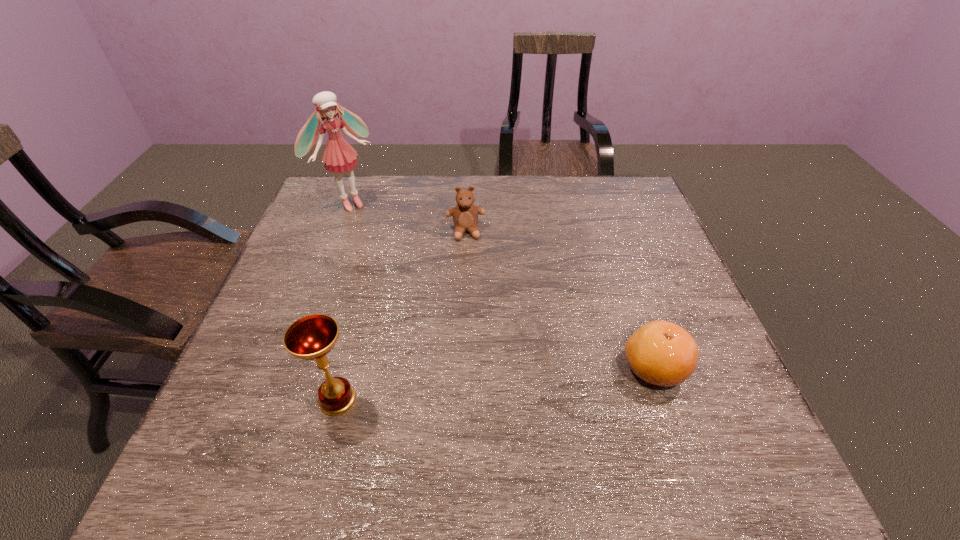
This screenshot has width=960, height=540. In order to click on free location that satisfies the following two spatial constraints: 1. on the back side of the chalice; 2. on the left side of the second object from right to left in this screenshot , I will do `click(381, 232)`.

At what (x,y) coordinates should I click in order to perform the action: click on vacant space that satisfies the following two spatial constraints: 1. on the front side of the shortest object; 2. on the left side of the tallest object. Please return your answer as a coordinate pair (x, y). The width and height of the screenshot is (960, 540). Looking at the image, I should click on (285, 368).

Find the location of a particular element. This screenshot has height=540, width=960. vacant region that satisfies the following two spatial constraints: 1. on the front side of the doll; 2. on the left side of the rightmost object is located at coordinates (285, 368).

This screenshot has height=540, width=960. In order to click on free space that satisfies the following two spatial constraints: 1. on the front side of the rightmost object; 2. on the right side of the tallest object in this screenshot , I will do click(x=285, y=368).